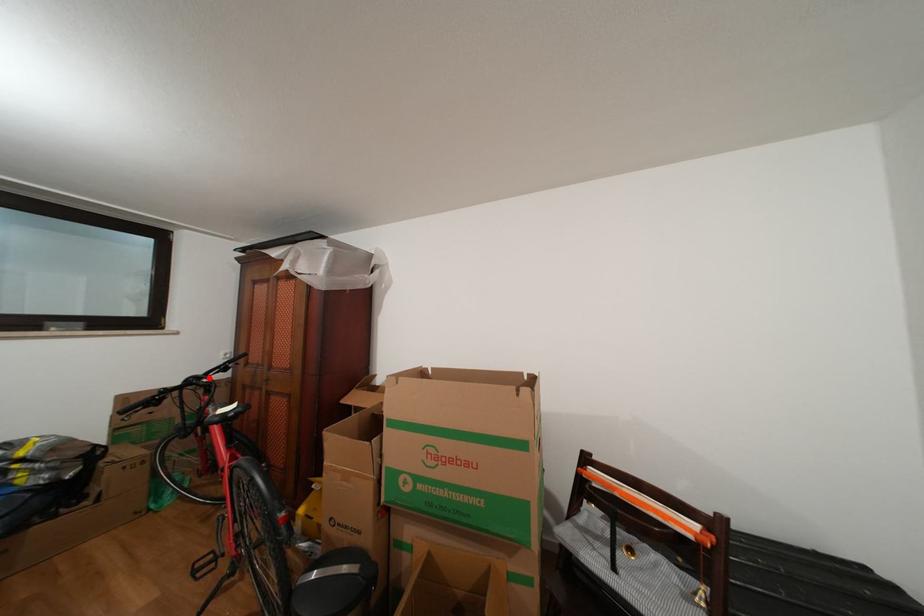
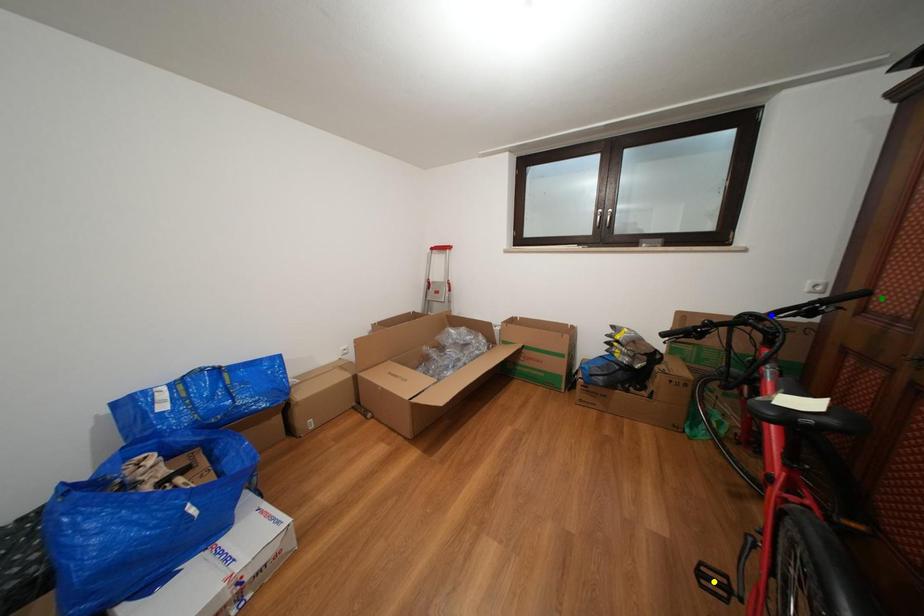
Question: I am providing you with two images of the same scene from different viewpoints. A red point is marked on the first image. You are given multiple points on the second image. Which point in image 2 represents the same 3d spot as the red point in image 1?

Choices:
 (A) green point
 (B) yellow point
 (C) blue point

Answer: (C)